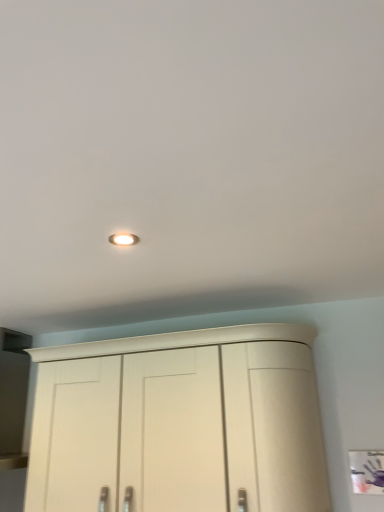
The image size is (384, 512). What do you see at coordinates (124, 239) in the screenshot?
I see `white glossy light fixture at upper center` at bounding box center [124, 239].

Where is `white glossy light fixture at upper center`? This screenshot has width=384, height=512. white glossy light fixture at upper center is located at coordinates (124, 239).

This screenshot has height=512, width=384. What do you see at coordinates (193, 419) in the screenshot?
I see `matte white cupboard at lower center` at bounding box center [193, 419].

This screenshot has width=384, height=512. What are the coordinates of `matte white cupboard at lower center` in the screenshot? It's located at (193, 419).

Where is `white glossy light fixture at upper center`? white glossy light fixture at upper center is located at coordinates (124, 239).

Is matte white cupboard at lower center to the left of white glossy light fixture at upper center from the viewer's perspective?

No, matte white cupboard at lower center is not to the left of white glossy light fixture at upper center.

Which object is closer to the camera, matte white cupboard at lower center or white glossy light fixture at upper center?

white glossy light fixture at upper center is closer to the camera.

Which is further, (173, 408) or (122, 245)?

The point (173, 408) is farther.

From the image's perspective, is matte white cupboard at lower center above white glossy light fixture at upper center?

Actually, matte white cupboard at lower center appears below white glossy light fixture at upper center in the image.

From a real-world perspective, is matte white cupboard at lower center physically located above or below white glossy light fixture at upper center?

matte white cupboard at lower center is situated lower than white glossy light fixture at upper center in the real world.

Considering the relative sizes of matte white cupboard at lower center and white glossy light fixture at upper center in the image provided, is matte white cupboard at lower center thinner than white glossy light fixture at upper center?

No, matte white cupboard at lower center is not thinner than white glossy light fixture at upper center.

Considering the sizes of objects matte white cupboard at lower center and white glossy light fixture at upper center in the image provided, who is shorter, matte white cupboard at lower center or white glossy light fixture at upper center?

With less height is white glossy light fixture at upper center.

Who is smaller, matte white cupboard at lower center or white glossy light fixture at upper center?

white glossy light fixture at upper center is smaller.

Is matte white cupboard at lower center completely or partially outside of white glossy light fixture at upper center?

Yes, matte white cupboard at lower center is not within white glossy light fixture at upper center.

Would you say matte white cupboard at lower center is a long distance from white glossy light fixture at upper center?

No, matte white cupboard at lower center is not far away from white glossy light fixture at upper center.

Is white glossy light fixture at upper center at the back of matte white cupboard at lower center?

matte white cupboard at lower center does not have its back to white glossy light fixture at upper center.

What's the angular difference between matte white cupboard at lower center and white glossy light fixture at upper center's facing directions?

There is a 2.7-degree angle between the facing directions of matte white cupboard at lower center and white glossy light fixture at upper center.

Locate an element on the screen. Image resolution: width=384 pixels, height=512 pixels. cupboard behind the white glossy light fixture at upper center is located at coordinates (193, 419).

Is white glossy light fixture at upper center to the left of matte white cupboard at lower center from the viewer's perspective?

Yes.

Relative to matte white cupboard at lower center, is white glossy light fixture at upper center in front or behind?

In the image, white glossy light fixture at upper center appears in front of matte white cupboard at lower center.

Which is behind, point (113, 243) or point (307, 370)?

Positioned behind is point (307, 370).

From the image's perspective, who appears lower, white glossy light fixture at upper center or matte white cupboard at lower center?

matte white cupboard at lower center, from the image's perspective.

From a real-world perspective, who is located higher, white glossy light fixture at upper center or matte white cupboard at lower center?

white glossy light fixture at upper center is physically above.

Considering the sizes of white glossy light fixture at upper center and matte white cupboard at lower center in the image, is white glossy light fixture at upper center wider or thinner than matte white cupboard at lower center?

Clearly, white glossy light fixture at upper center has less width compared to matte white cupboard at lower center.

Considering the relative sizes of white glossy light fixture at upper center and matte white cupboard at lower center in the image provided, is white glossy light fixture at upper center shorter than matte white cupboard at lower center?

Yes.

Considering the relative sizes of white glossy light fixture at upper center and matte white cupboard at lower center in the image provided, is white glossy light fixture at upper center bigger than matte white cupboard at lower center?

Actually, white glossy light fixture at upper center might be smaller than matte white cupboard at lower center.

Is matte white cupboard at lower center located within white glossy light fixture at upper center?

Actually, matte white cupboard at lower center is outside white glossy light fixture at upper center.

Are white glossy light fixture at upper center and matte white cupboard at lower center located far from each other?

No, there isn't a large distance between white glossy light fixture at upper center and matte white cupboard at lower center.

Is white glossy light fixture at upper center positioned with its back to matte white cupboard at lower center?

No, white glossy light fixture at upper center is not facing the opposite direction of matte white cupboard at lower center.

How different are the orientations of white glossy light fixture at upper center and matte white cupboard at lower center in degrees?

There is a 2.7-degree angle between the facing directions of white glossy light fixture at upper center and matte white cupboard at lower center.

This screenshot has width=384, height=512. What are the coordinates of `cupboard that appears below the white glossy light fixture at upper center (from a real-world perspective)` in the screenshot? It's located at (193, 419).

Find the location of a particular element. lighting above the matte white cupboard at lower center (from the image's perspective) is located at coordinates (124, 239).

Where is `lighting located in front of the matte white cupboard at lower center`? lighting located in front of the matte white cupboard at lower center is located at coordinates (124, 239).